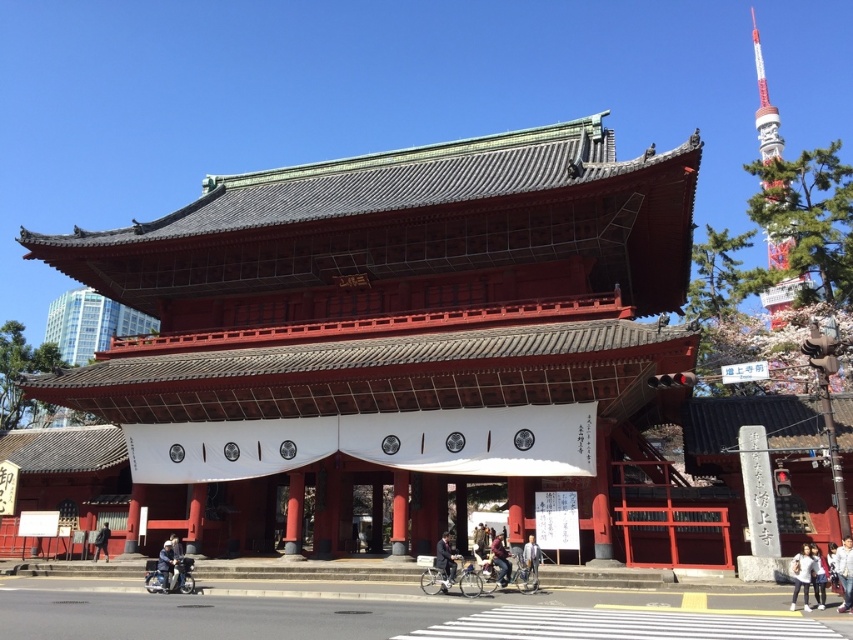
Question: Can you confirm if dark blue suit at center is bigger than denim jacket at center?

Choices:
 (A) no
 (B) yes

Answer: (B)

Question: Does dark blue suit at center appear over dark brown leather jacket at center?

Choices:
 (A) yes
 (B) no

Answer: (A)

Question: Which of the following is the farthest from the observer?

Choices:
 (A) (181, 582)
 (B) (128, 515)
 (C) (163, 564)
 (D) (527, 541)

Answer: (B)

Question: Which object is positioned farthest from the shiny chrome motorcycle at center?

Choices:
 (A) dark brown leather jacket at center
 (B) metallic silver motorcycle at lower left

Answer: (B)

Question: Can you confirm if white fabric at center is wider than denim jacket at center?

Choices:
 (A) yes
 (B) no

Answer: (A)

Question: Estimate the real-world distances between objects in this image. Which object is farther from the metallic silver motorcycle at lower center?

Choices:
 (A) white fabric at center
 (B) white cotton shirt at center
 (C) dark blue suit at center
 (D) shiny chrome motorcycle at center

Answer: (A)